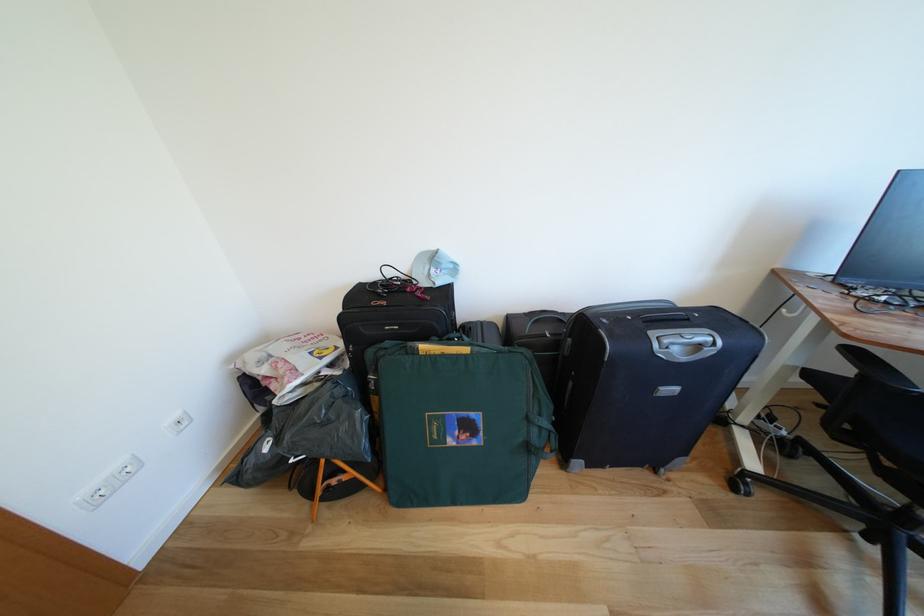
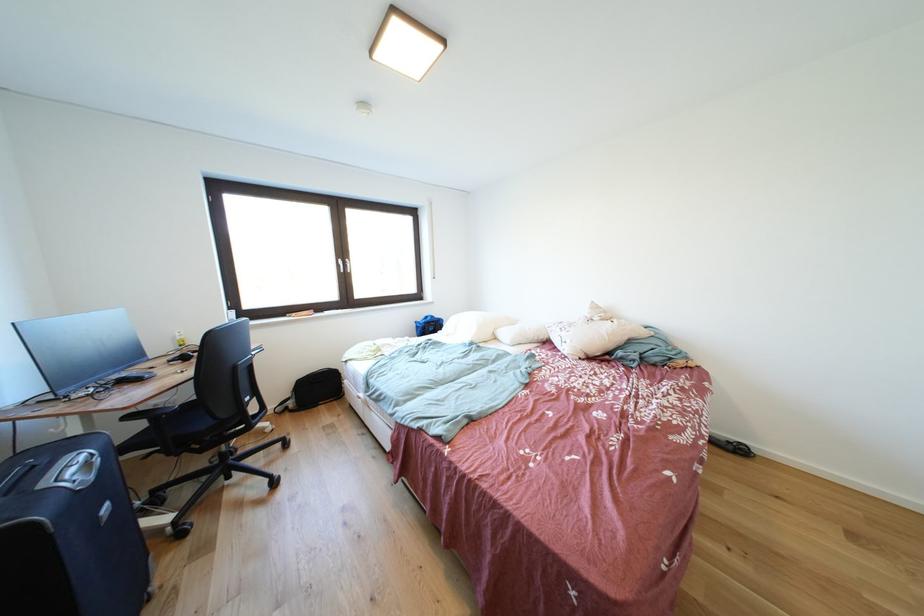
Find the pixel in the second image that matches (x=854, y=341) in the first image.

(134, 413)